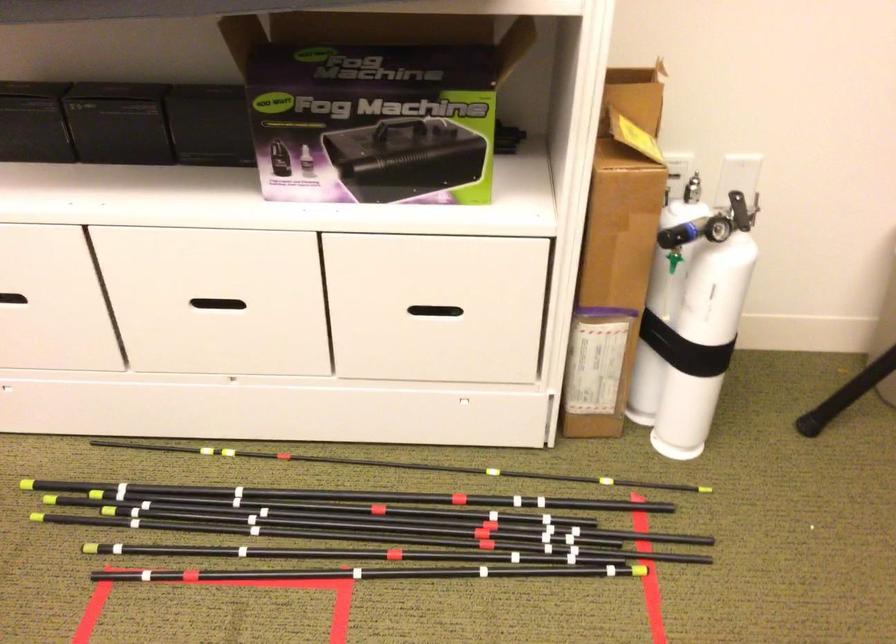
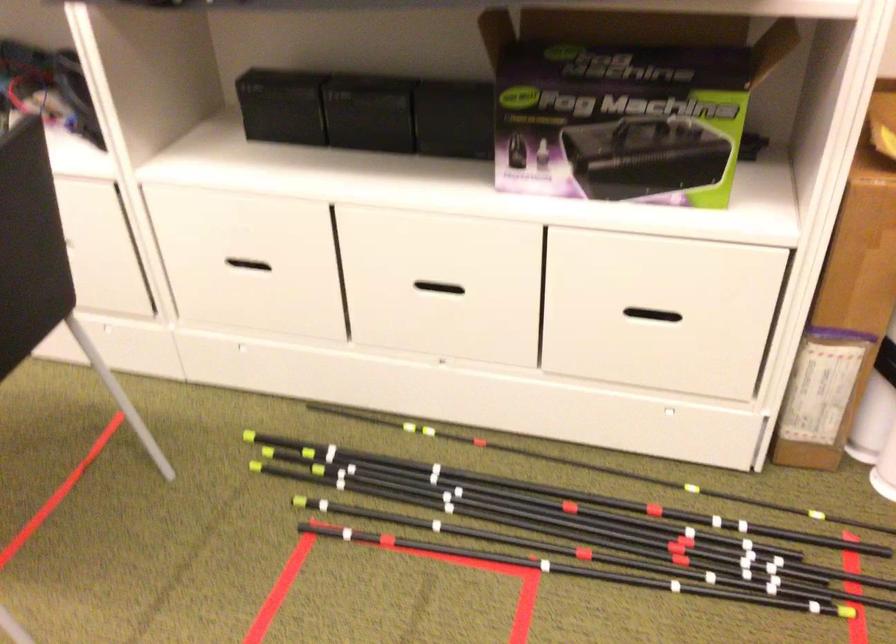
The point at [295,460] is marked in the first image. Where is the corresponding point in the second image?

(493, 448)